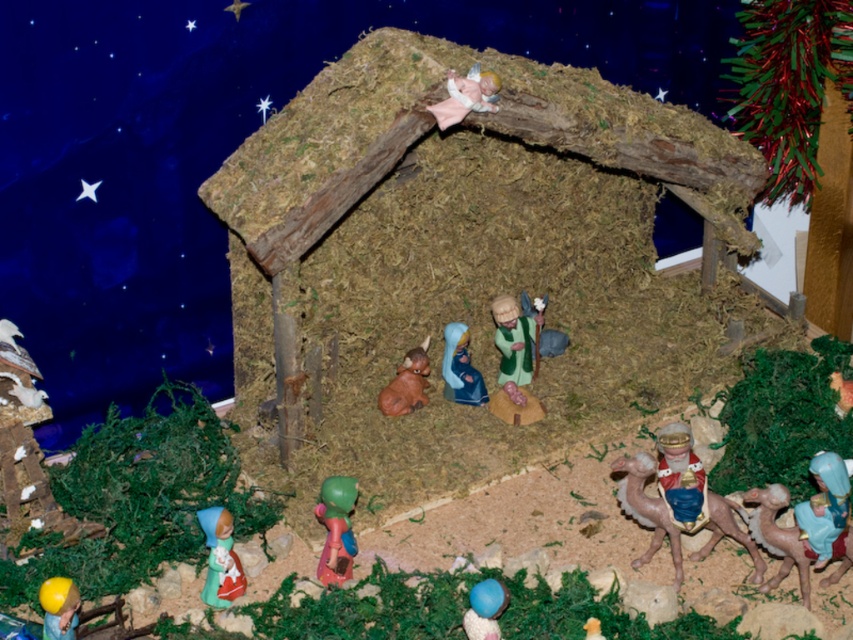
You are setting up a Christmas display and want to take a photo of the brown matte camel at lower right. If your camera is 1.26 meters away from the camel, will you be able to capture the entire camel in the shot without moving closer?

The brown matte camel at lower right and camera are 1.26 meters apart, so yes, you can capture the entire camel in the shot without moving closer as the distance is sufficient.

You are setting up a Christmas display and have a small shelf that can only hold items up to 10 cm wide. You have the yellow rubber ball at lower left and the smooth yellow toy at lower center. Which item can fit on the shelf?

The smooth yellow toy at lower center can fit on the shelf since its width is smaller than the yellow rubber ball at lower left, which exceeds the 10 cm limit.

Based on the photo, in the nativity scene, you see a smooth green fabric at center and a yellow rubber ball at lower left. Which object is positioned to the right of the other?

The smooth green fabric at center is to the right of yellow rubber ball at lower left.